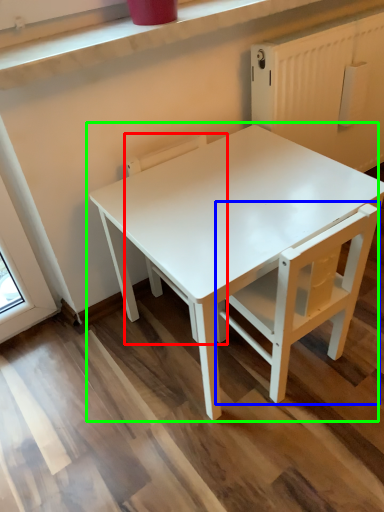
Question: Which object is positioned farthest from chair (highlighted by a red box)? Select from chair (highlighted by a blue box) and table (highlighted by a green box).

Choices:
 (A) chair
 (B) table

Answer: (B)